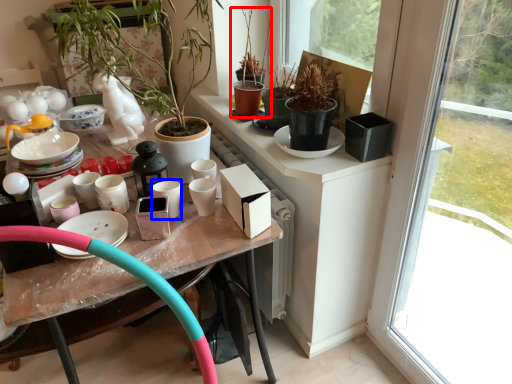
Question: Which point is further to the camera, houseplant (highlighted by a red box) or tableware (highlighted by a blue box)?

Choices:
 (A) houseplant
 (B) tableware

Answer: (A)